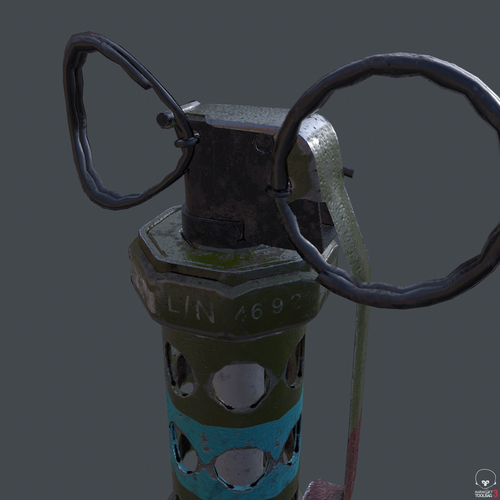
Locate an element on the screen. scratched part of octagonal top is located at coordinates (146, 298).